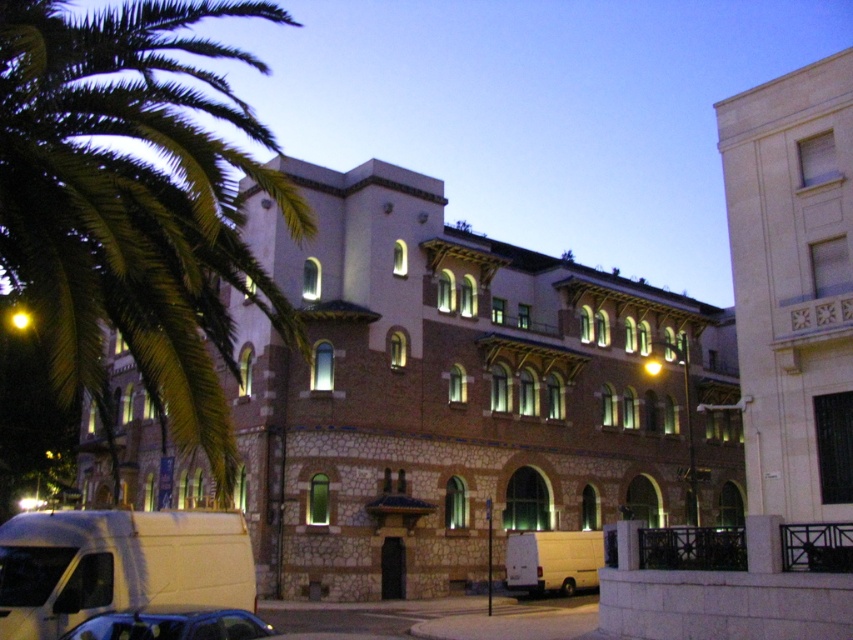
Question: Is white stone building at upper right smaller than white matte van at lower center?

Choices:
 (A) yes
 (B) no

Answer: (B)

Question: Which is farther from the green leafy palm tree at upper left?

Choices:
 (A) white matte van at lower center
 (B) white matte van at lower left
 (C) metallic blue car at lower left

Answer: (A)

Question: Which point is farther from the camera taking this photo?

Choices:
 (A) (254, 177)
 (B) (13, 552)
 (C) (534, 589)

Answer: (C)

Question: Estimate the real-world distances between objects in this image. Which object is farther from the white matte van at lower center?

Choices:
 (A) green leafy palm tree at upper left
 (B) white stone building at upper right
 (C) metallic blue car at lower left
 (D) white matte van at lower left

Answer: (C)

Question: Is white stone building at upper right to the left of metallic blue car at lower left from the viewer's perspective?

Choices:
 (A) yes
 (B) no

Answer: (B)

Question: Is green leafy palm tree at upper left wider than white matte van at lower left?

Choices:
 (A) no
 (B) yes

Answer: (B)